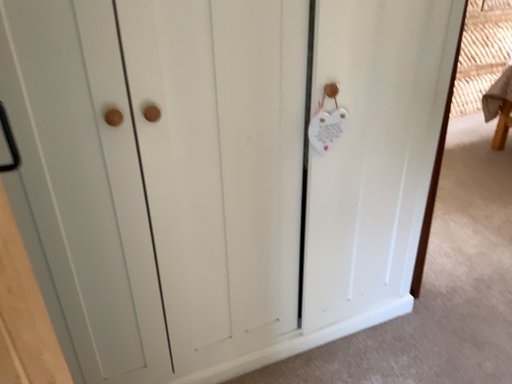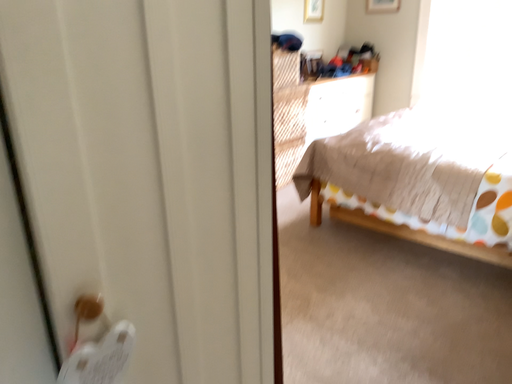
Question: Which way did the camera rotate in the video?

Choices:
 (A) rotated downward
 (B) rotated upward

Answer: (B)